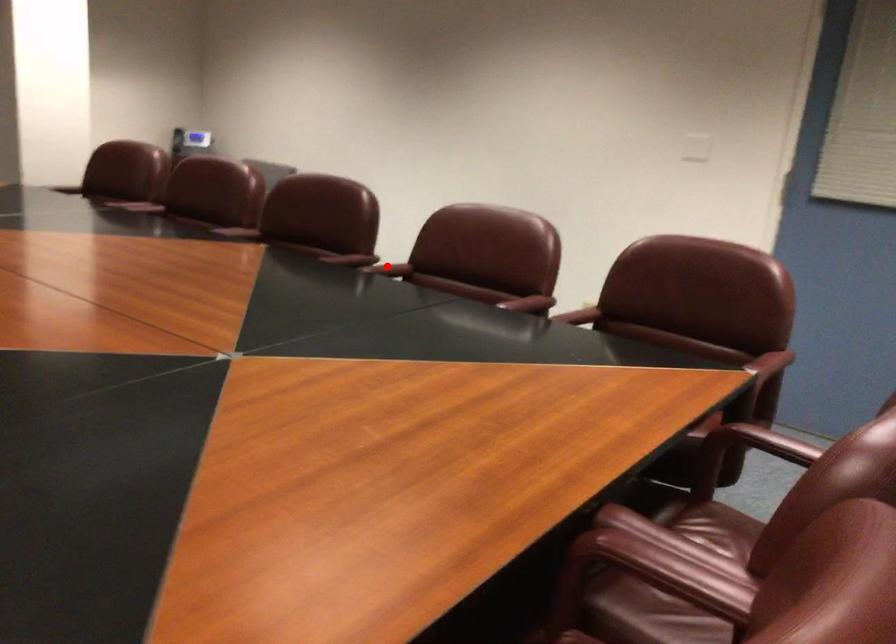
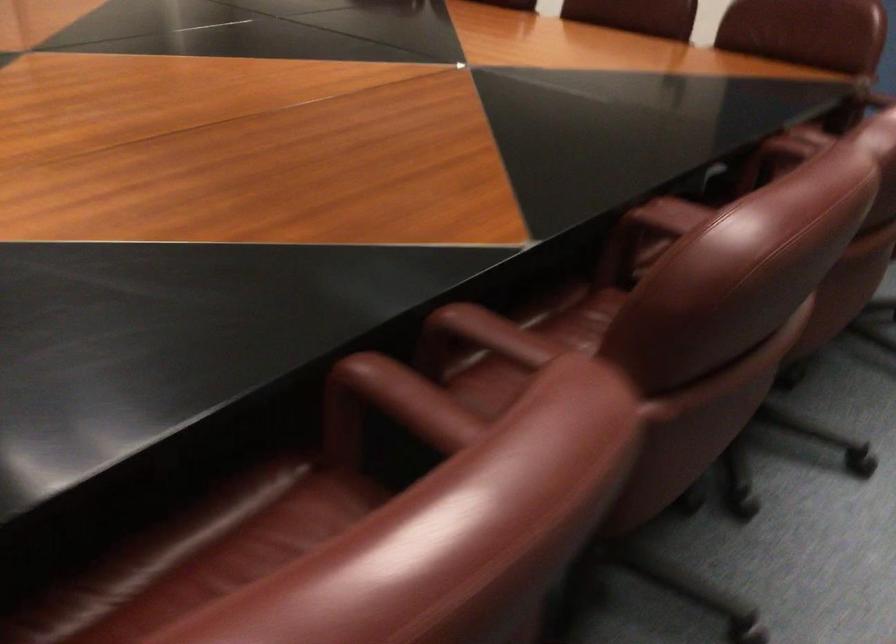
Question: I am providing you with two images of the same scene from different viewpoints. A red point is shown in image1. For the corresponding object point in image2, is it positioned nearer or farther from the camera?

Choices:
 (A) Nearer
 (B) Farther

Answer: (A)